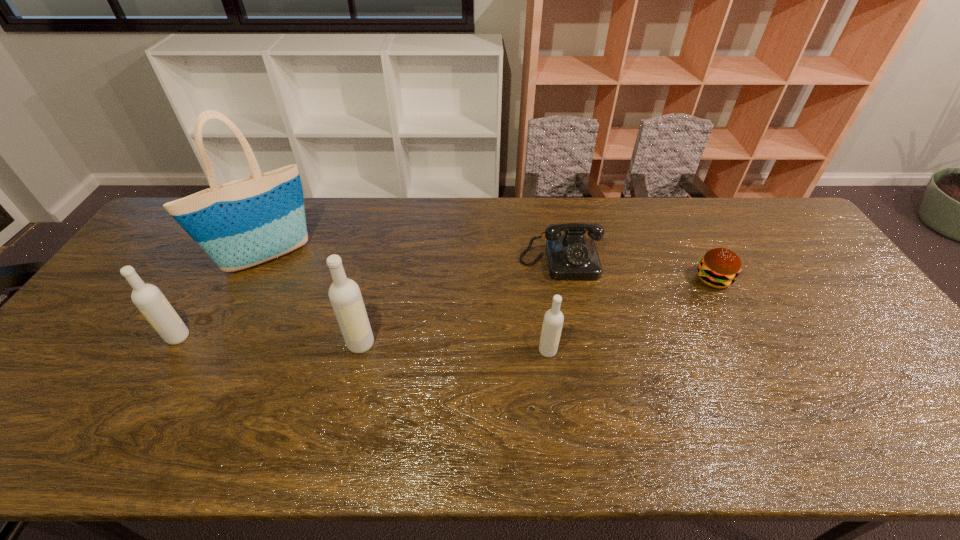
Where is `free region at the right edge of the desktop`? Image resolution: width=960 pixels, height=540 pixels. free region at the right edge of the desktop is located at coordinates (889, 343).

At what (x,y) coordinates should I click in order to perform the action: click on free space between the tote bag and the tallest vodka. Please return your answer as a coordinate pair (x, y). Looking at the image, I should click on (314, 301).

At what (x,y) coordinates should I click in order to perform the action: click on vacant space that is in between the tote bag and the shortest vodka. Please return your answer as a coordinate pair (x, y). Looking at the image, I should click on (407, 305).

The height and width of the screenshot is (540, 960). I want to click on free space between the fifth tallest object and the second vodka from right to left, so click(461, 303).

Image resolution: width=960 pixels, height=540 pixels. I want to click on free point between the fourth shortest object and the hamburger, so click(x=445, y=308).

You are a GUI agent. You are given a task and a screenshot of the screen. Output one action in this format:
    pyautogui.click(x=<x>, y=<y>)
    Task: Click on the vacant space that is in between the fourth tallest object and the tote bag
    
    Given the screenshot: What is the action you would take?
    pyautogui.click(x=407, y=305)

In order to click on empty location between the telephone and the tote bag in this screenshot , I will do `click(414, 260)`.

The height and width of the screenshot is (540, 960). I want to click on vacant area that lies between the shortest object and the tote bag, so click(x=490, y=268).

At what (x,y) coordinates should I click in order to perform the action: click on free space that is in between the rightmost vodka and the rightmost object. Please return your answer as a coordinate pair (x, y). Image resolution: width=960 pixels, height=540 pixels. Looking at the image, I should click on (631, 315).

Find the location of a particular element. The height and width of the screenshot is (540, 960). free point between the tallest vodka and the fifth tallest object is located at coordinates (461, 303).